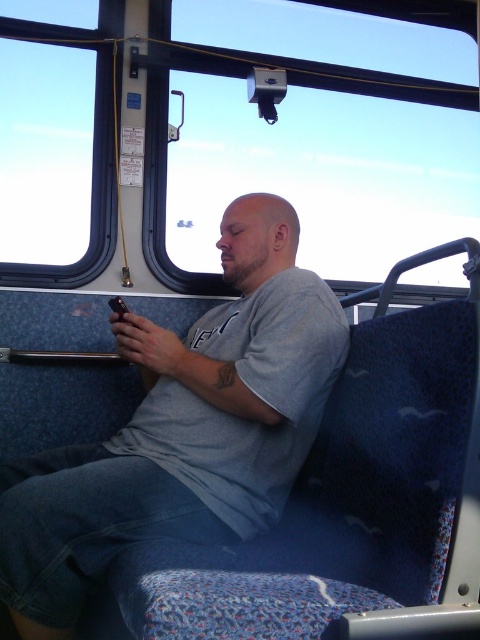
Question: Which point is farther from the camera taking this photo?

Choices:
 (A) (39, 141)
 (B) (430, 282)

Answer: (B)

Question: Is transparent glass window at center further to the viewer compared to transparent glass window at upper left?

Choices:
 (A) yes
 (B) no

Answer: (A)

Question: Is transparent glass window at center positioned in front of transparent glass window at upper left?

Choices:
 (A) no
 (B) yes

Answer: (A)

Question: Is transparent glass window at center to the left of transparent glass window at upper left from the viewer's perspective?

Choices:
 (A) no
 (B) yes

Answer: (A)

Question: Which of the following is the farthest from the observer?

Choices:
 (A) transparent glass window at upper left
 (B) transparent glass window at center

Answer: (B)